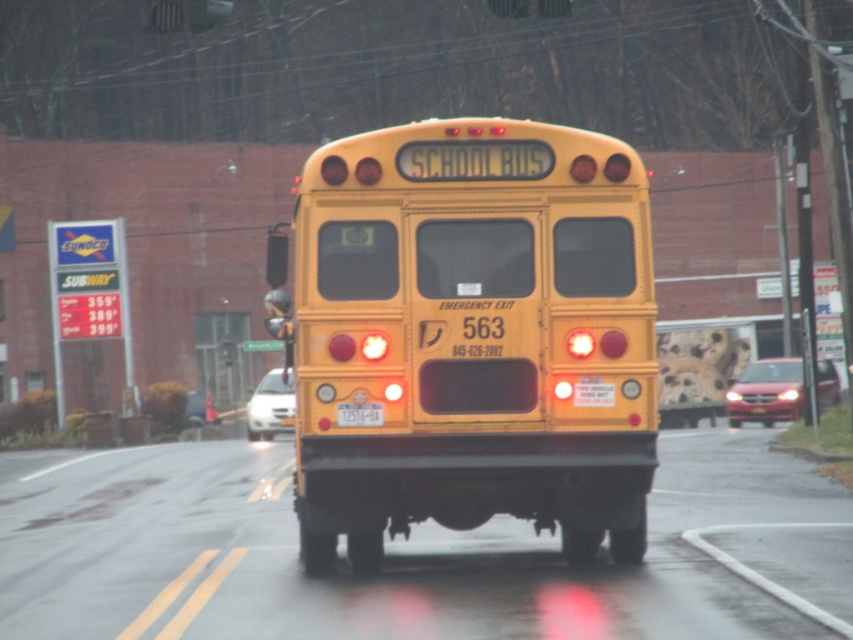
Question: Is yellow matte/solid school bus at center below yellow matte license plate at center?

Choices:
 (A) no
 (B) yes

Answer: (A)

Question: Among these points, which one is nearest to the camera?

Choices:
 (A) (312, 451)
 (B) (352, 422)

Answer: (B)

Question: Which point is closer to the camera?

Choices:
 (A) yellow matte/solid school bus at center
 (B) yellow matte license plate at center

Answer: (A)

Question: Does yellow matte/solid school bus at center have a larger size compared to yellow matte license plate at center?

Choices:
 (A) no
 (B) yes

Answer: (B)

Question: Is yellow matte/solid school bus at center to the right of yellow matte license plate at center from the viewer's perspective?

Choices:
 (A) no
 (B) yes

Answer: (B)

Question: Among these points, which one is farthest from the camera?

Choices:
 (A) (521, 392)
 (B) (357, 401)

Answer: (A)